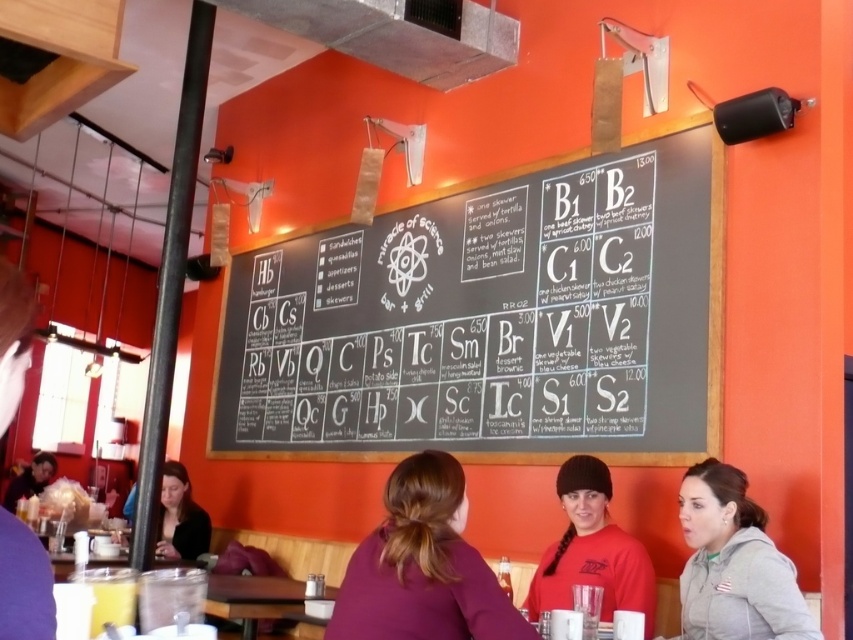
Is point (248, 387) farther from camera compared to point (165, 525)?

Yes, point (248, 387) is behind point (165, 525).

Is black chalkboard menu at center positioned behind matte black shirt at lower left?

That is False.

Is point (404, 445) positioned before point (160, 529)?

Yes, it is.

Where is `black chalkboard menu at center`? black chalkboard menu at center is located at coordinates pyautogui.click(x=491, y=321).

Can you confirm if gray fleece jacket at lower right is positioned above matte black jacket at lower left?

Correct, gray fleece jacket at lower right is located above matte black jacket at lower left.

Does gray fleece jacket at lower right have a lesser width compared to matte black jacket at lower left?

Indeed, gray fleece jacket at lower right has a lesser width compared to matte black jacket at lower left.

Does point (726, 628) come farther from viewer compared to point (38, 483)?

That is False.

This screenshot has width=853, height=640. Find the location of `gray fleece jacket at lower right`. gray fleece jacket at lower right is located at coordinates (734, 563).

Between point (373, 560) and point (711, 560), which one is positioned behind?

Point (711, 560)

Who is taller, purple fabric hair at center or gray fleece jacket at lower right?

Standing taller between the two is gray fleece jacket at lower right.

Who is more forward, (x=386, y=548) or (x=762, y=529)?

Point (x=386, y=548)

Where is `purple fabric hair at center`? purple fabric hair at center is located at coordinates (422, 566).